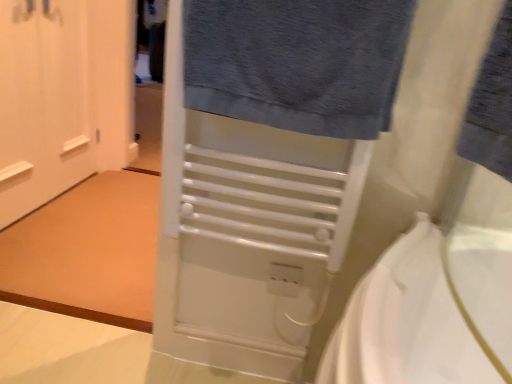
Question: Based on their sizes in the image, would you say white matte door at left is bigger or smaller than dark gray textured towel at upper center?

Choices:
 (A) small
 (B) big

Answer: (B)

Question: From a real-world perspective, is white matte door at left physically located above or below dark gray textured towel at upper center?

Choices:
 (A) below
 (B) above

Answer: (A)

Question: Estimate the real-world distances between objects in this image. Which object is farther from the dark gray textured towel at upper center?

Choices:
 (A) blue cotton towel at upper right
 (B) white plastic electric outlet at center
 (C) white matte door at left

Answer: (C)

Question: Which object is the farthest from the dark gray textured towel at upper center?

Choices:
 (A) blue cotton towel at upper right
 (B) white matte door at left
 (C) white plastic electric outlet at center

Answer: (B)